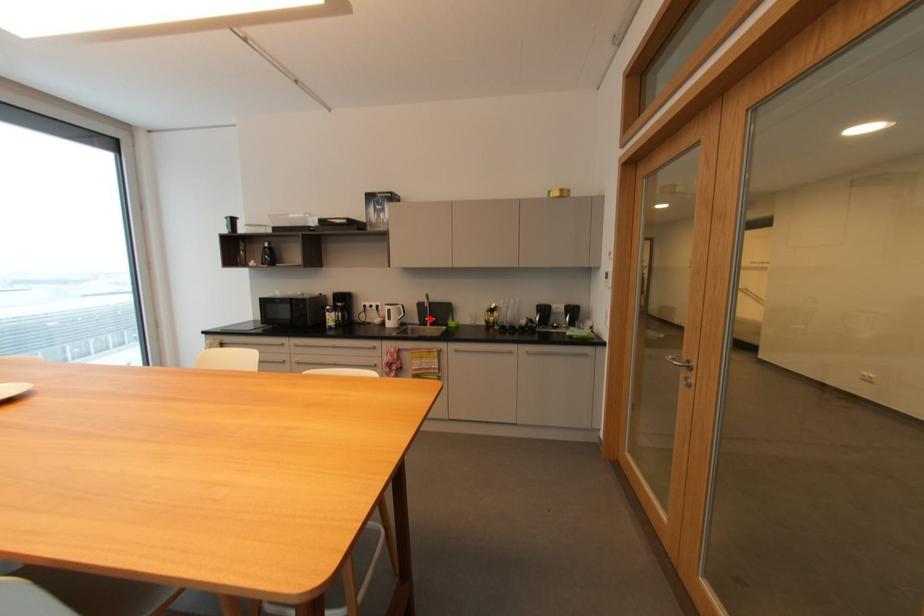
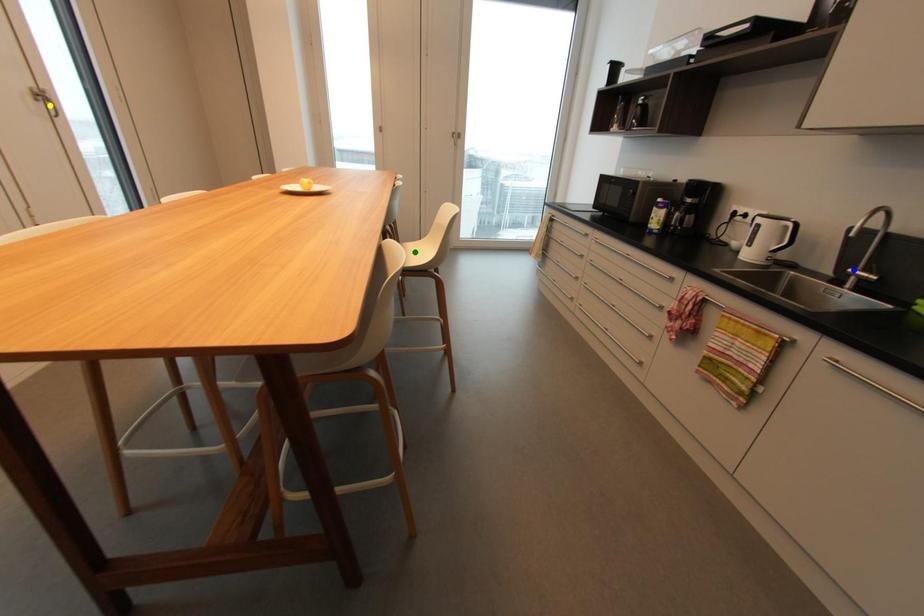
Question: I am providing you with two images of the same scene from different viewpoints. A red point is marked on the first image. You are given multiple points on the second image. Which mark in image 2 goes with the point in image 1?

Choices:
 (A) yellow point
 (B) blue point
 (C) green point

Answer: (B)